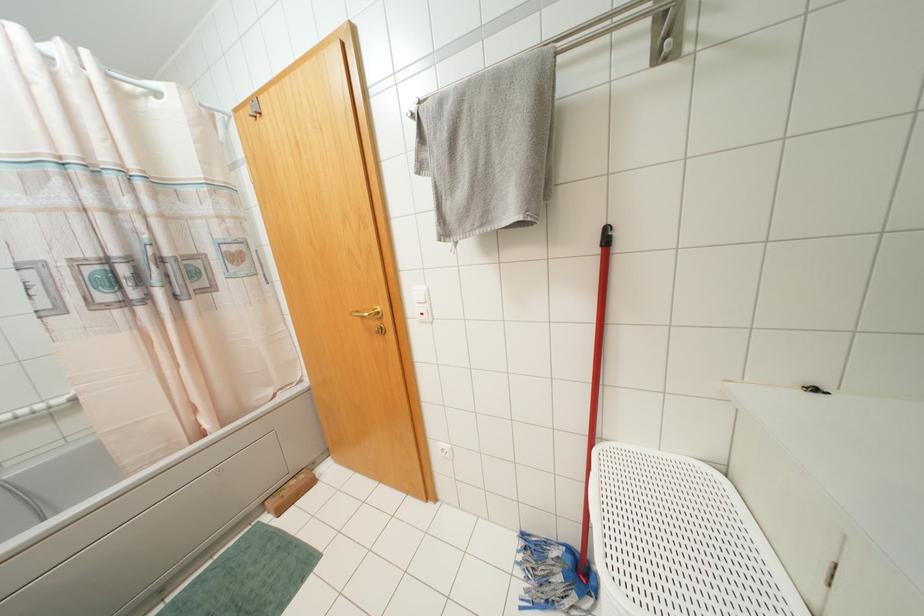
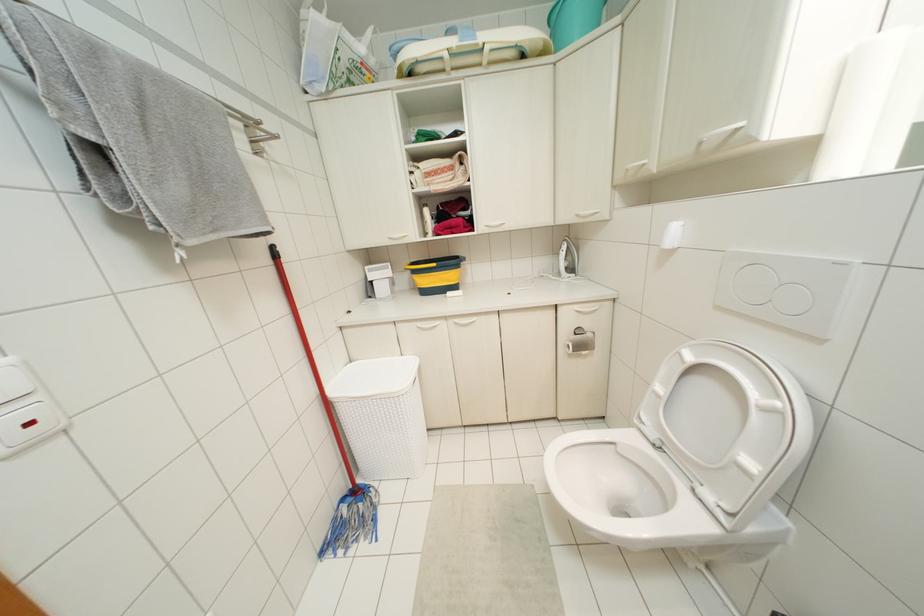
Where in the second image is the point corresponding to (606,229) from the first image?

(273, 246)